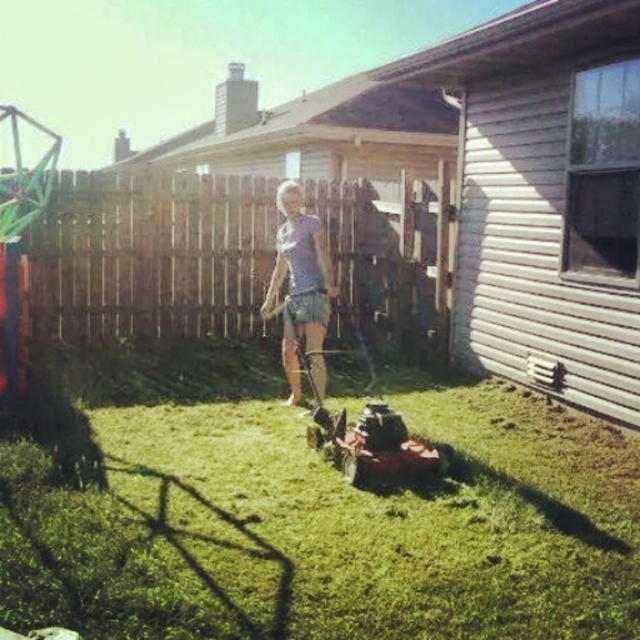
You are a drone operator trying to capture a photo of the light blue denim shorts at center without including the brown wooden fence at center in the frame. Based on their sizes, can you adjust your camera angle to exclude the fence?

The brown wooden fence at center is larger than the light blue denim shorts at center, so adjusting the camera angle to focus on the shorts while avoiding the fence might be challenging due to the fence being bigger in the frame.

Based on the photo, you are standing in the backyard and want to place a new garden bench exactly at the point marked as point (276, 371). If the bench requires a space of 30 feet from the viewer to be placed safely, will this location work?

The distance of point (276, 371) from viewer is 27.52 feet, which is less than the required 30 feet. Therefore, placing the bench there would not be safe as it is too close.